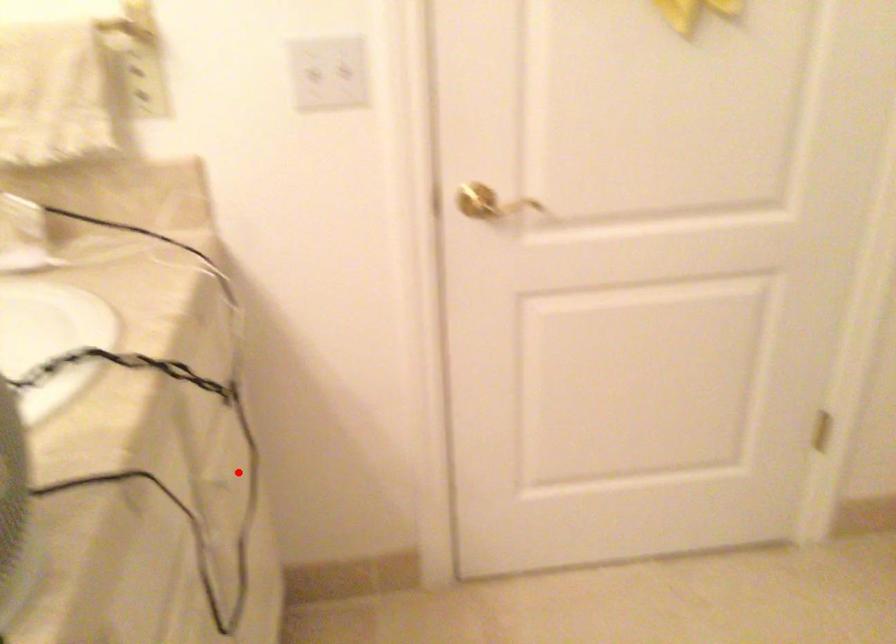
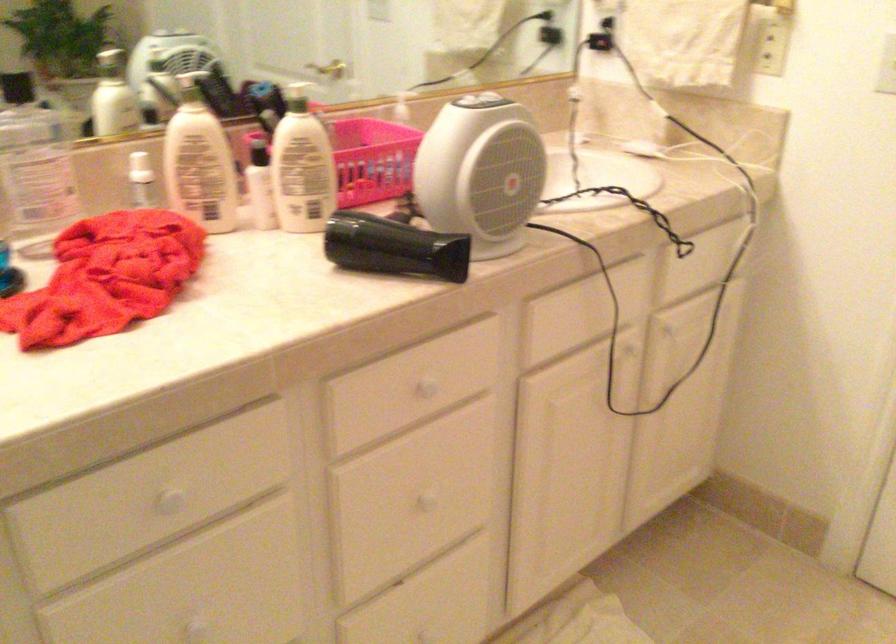
Question: I am providing you with two images of the same scene from different viewpoints. A red point is marked on the first image. Is the red point's position out of view in image 2?

Choices:
 (A) Yes
 (B) No

Answer: (B)